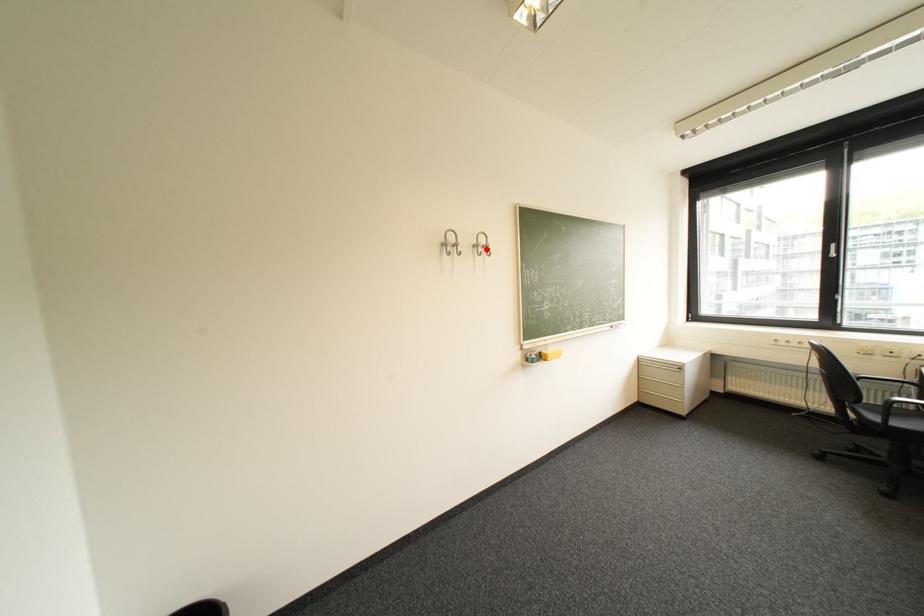
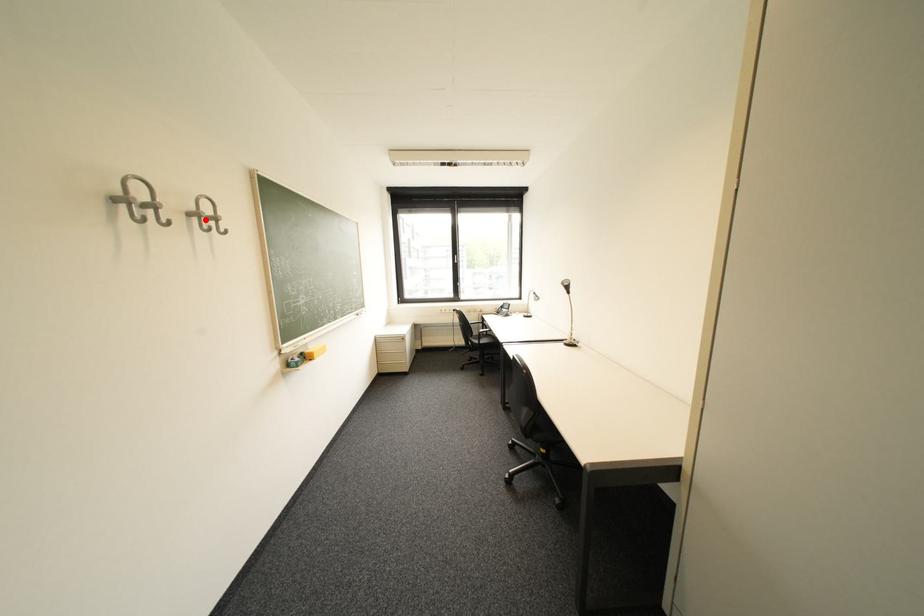
In the scene shown: I am providing you with two images of the same scene from different viewpoints. A red point is marked on the first image and another point is marked on the second image. Is the red point in image1 aligned with the point shown in image2?

Yes